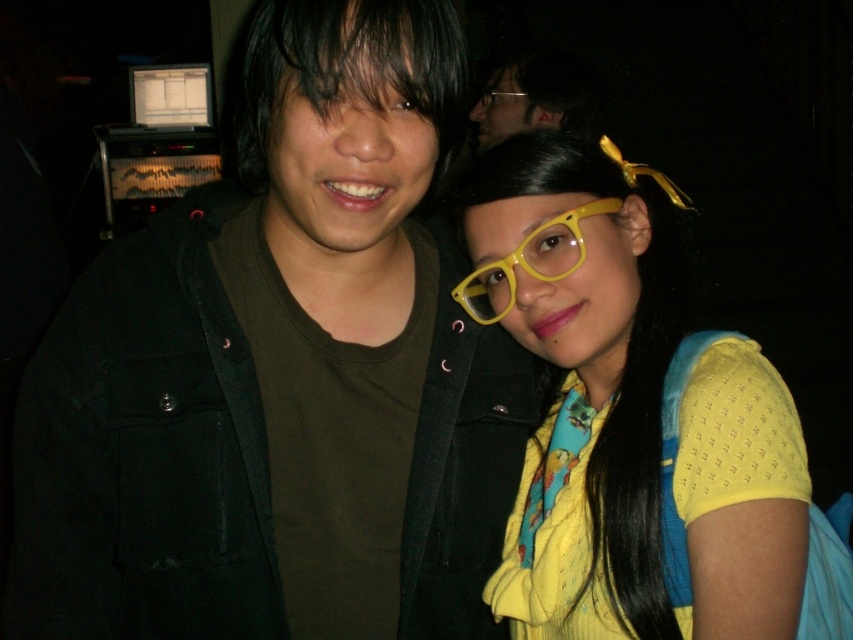
Question: Does black matte jacket at left have a greater width compared to yellow matte glasses at center?

Choices:
 (A) no
 (B) yes

Answer: (B)

Question: From the image, what is the correct spatial relationship of yellow matte glasses at center in relation to yellow plastic glasses at upper center?

Choices:
 (A) right
 (B) left

Answer: (B)

Question: Which object appears closest to the camera in this image?

Choices:
 (A) yellow plastic glasses at center
 (B) black matte jacket at left
 (C) yellow plastic glasses at upper center
 (D) matte black jacket at upper left

Answer: (B)

Question: Which is farther from the yellow plastic glasses at upper center?

Choices:
 (A) matte black jacket at upper left
 (B) black matte jacket at left

Answer: (B)

Question: Can you confirm if matte black jacket at upper left is positioned to the right of yellow plastic glasses at upper center?

Choices:
 (A) yes
 (B) no

Answer: (A)

Question: Estimate the real-world distances between objects in this image. Which object is closer to the yellow plastic glasses at upper center?

Choices:
 (A) black matte jacket at left
 (B) matte black jacket at upper left
 (C) yellow matte glasses at center
 (D) yellow plastic glasses at center

Answer: (B)